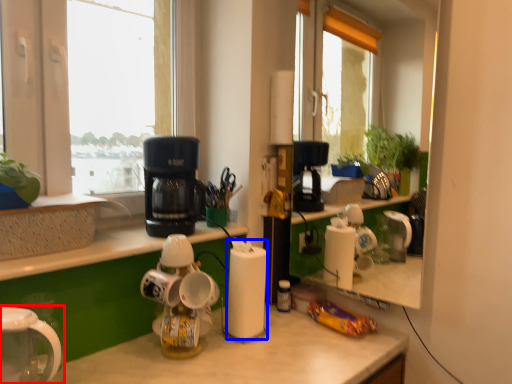
Question: Which point is further to the camera, home appliance (highlighted by a red box) or paper towel (highlighted by a blue box)?

Choices:
 (A) home appliance
 (B) paper towel

Answer: (B)